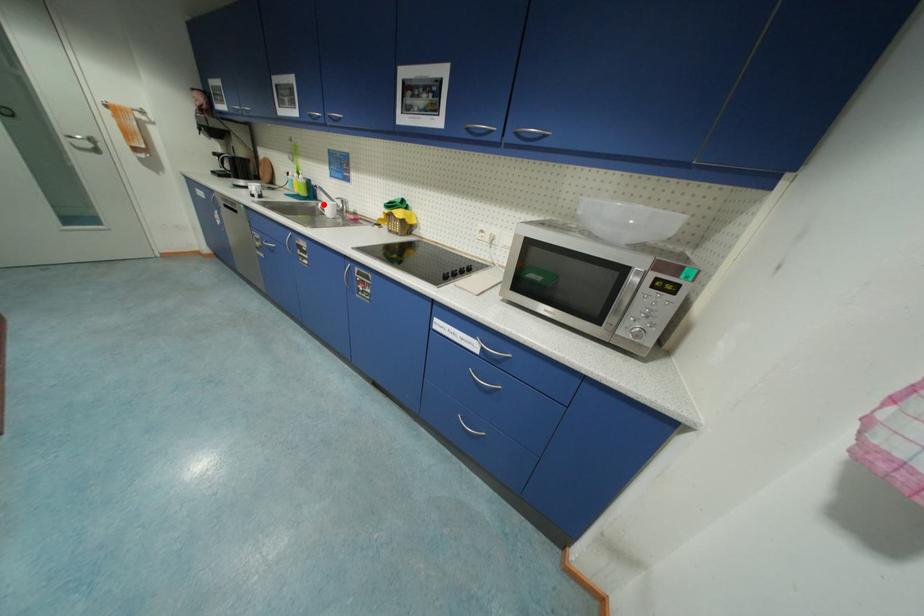
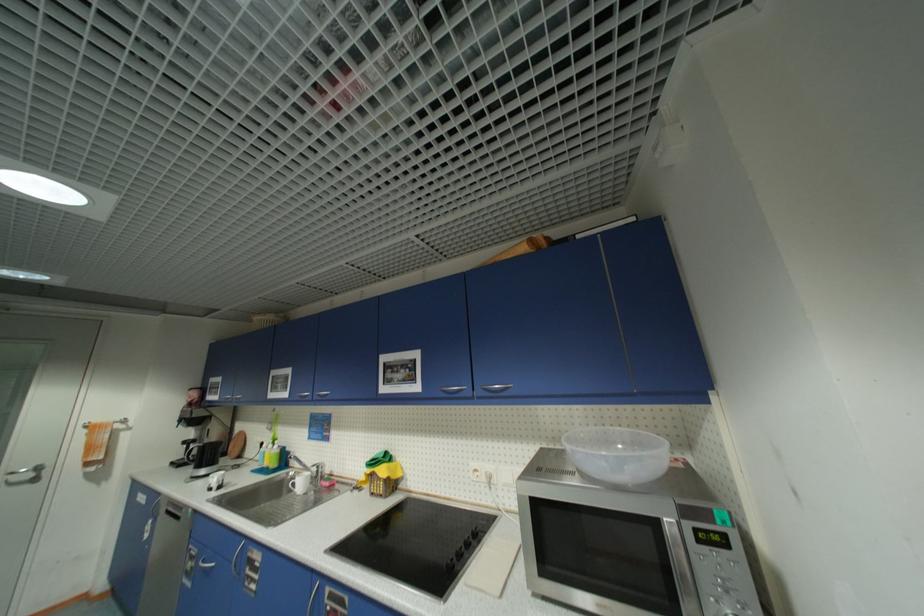
Question: I am providing you with two images of the same scene from different viewpoints. In image1, a red point is highlighted. Considering the same 3D point in image2, which of the following is correct?

Choices:
 (A) It is closer
 (B) It is farther

Answer: (B)